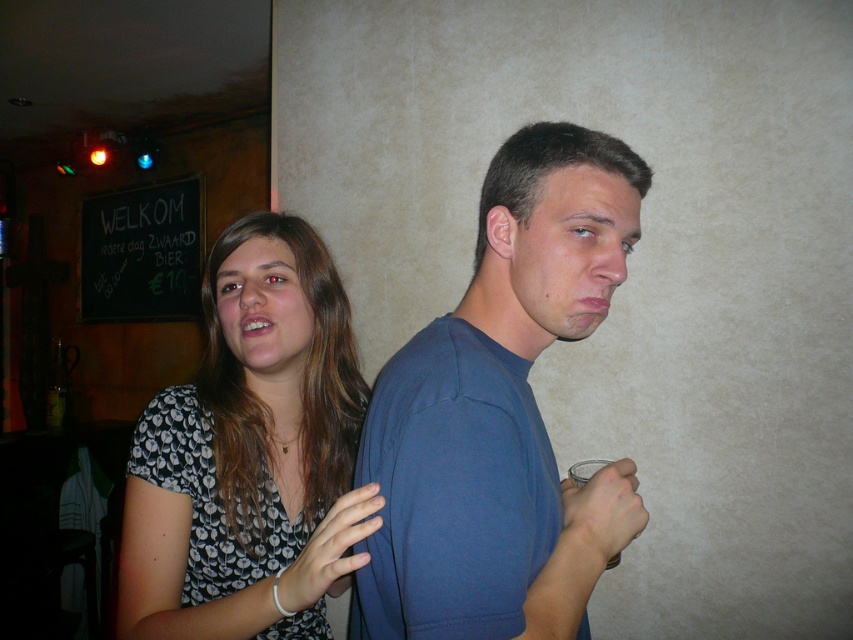
Which is more to the right, blue cotton t-shirt at center or floral print blouse at center?

blue cotton t-shirt at center

Can you confirm if blue cotton t-shirt at center is shorter than floral print blouse at center?

Indeed, blue cotton t-shirt at center has a lesser height compared to floral print blouse at center.

Which is behind, point (502, 250) or point (224, 269)?

The point (224, 269) is behind.

The width and height of the screenshot is (853, 640). In order to click on blue cotton t-shirt at center in this screenshot , I will do `click(502, 412)`.